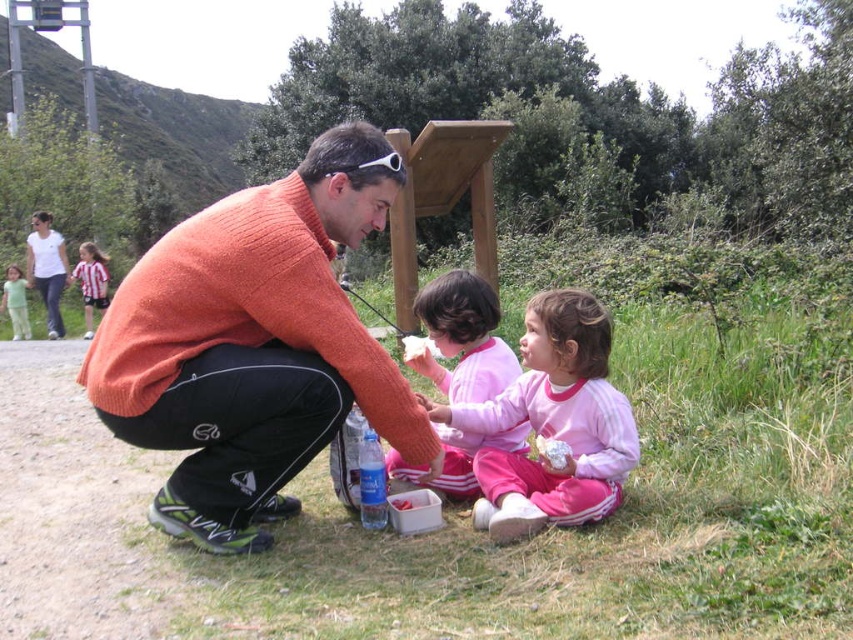
Is pink fleece jacket at lower center to the left of white plastic bag at lower center from the viewer's perspective?

Indeed, pink fleece jacket at lower center is positioned on the left side of white plastic bag at lower center.

Which is more to the left, pink fleece jacket at lower center or white plastic bag at lower center?

pink fleece jacket at lower center

Which is behind, point (585, 396) or point (547, 449)?

Point (585, 396)

The image size is (853, 640). I want to click on pink fleece jacket at lower center, so (553, 422).

Is point (265, 465) positioned in front of point (477, 493)?

Yes, point (265, 465) is in front of point (477, 493).

Describe the element at coordinates (254, 346) in the screenshot. I see `orange knitted sweater at center` at that location.

I want to click on orange knitted sweater at center, so click(254, 346).

Who is positioned more to the right, orange knitted sweater at center or striped jersey at upper left?

From the viewer's perspective, orange knitted sweater at center appears more on the right side.

Can you confirm if orange knitted sweater at center is thinner than striped jersey at upper left?

Incorrect, orange knitted sweater at center's width is not less than striped jersey at upper left's.

Is point (297, 432) farther from camera compared to point (91, 276)?

No, it is not.

Identify the location of orange knitted sweater at center. This screenshot has width=853, height=640. (254, 346).